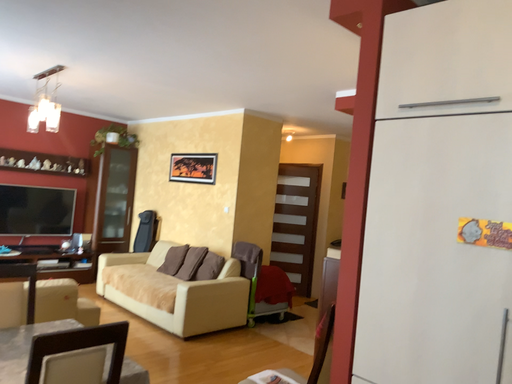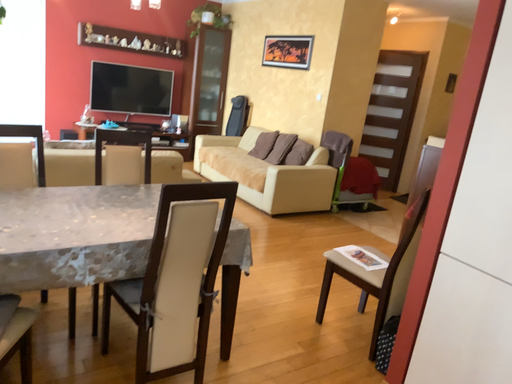
Question: How did the camera likely rotate when shooting the video?

Choices:
 (A) rotated upward
 (B) rotated downward

Answer: (B)